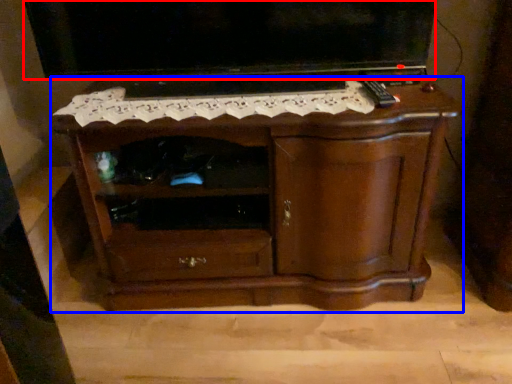
Question: Which object is closer to the camera taking this photo, television (highlighted by a red box) or chest of drawers (highlighted by a blue box)?

Choices:
 (A) television
 (B) chest of drawers

Answer: (B)